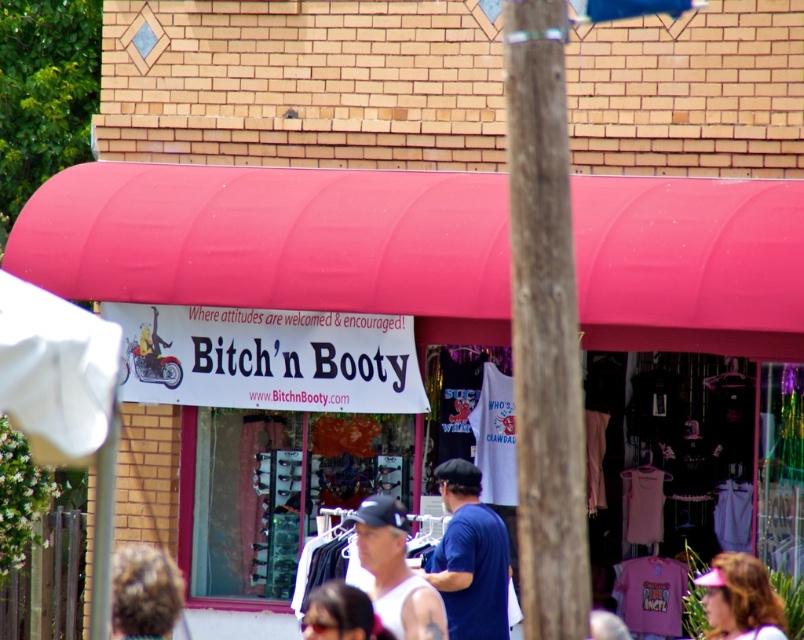
Who is positioned more to the left, blue cotton shirt at center or pink fabric visor at lower right?

Positioned to the left is blue cotton shirt at center.

Looking at this image, who is more distant from viewer, (502,557) or (741,584)?

Positioned behind is point (502,557).

Does point (454, 532) lie in front of point (720, 612)?

No, it is behind (720, 612).

Identify the location of blue cotton shirt at center. (470, 557).

Which is more to the left, white tank top at center or pink fabric visor at lower right?

white tank top at center

Is the position of white tank top at center more distant than that of pink fabric visor at lower right?

That is False.

Is point (378, 602) in front of point (749, 566)?

Yes, it is.

This screenshot has width=804, height=640. I want to click on white tank top at center, so click(396, 572).

Is point (76, 227) positioned before point (507, 536)?

No.

Is matte pink awning at center bigger than blue cotton shirt at center?

Correct, matte pink awning at center is larger in size than blue cotton shirt at center.

Identify the location of matte pink awning at center. (277, 241).